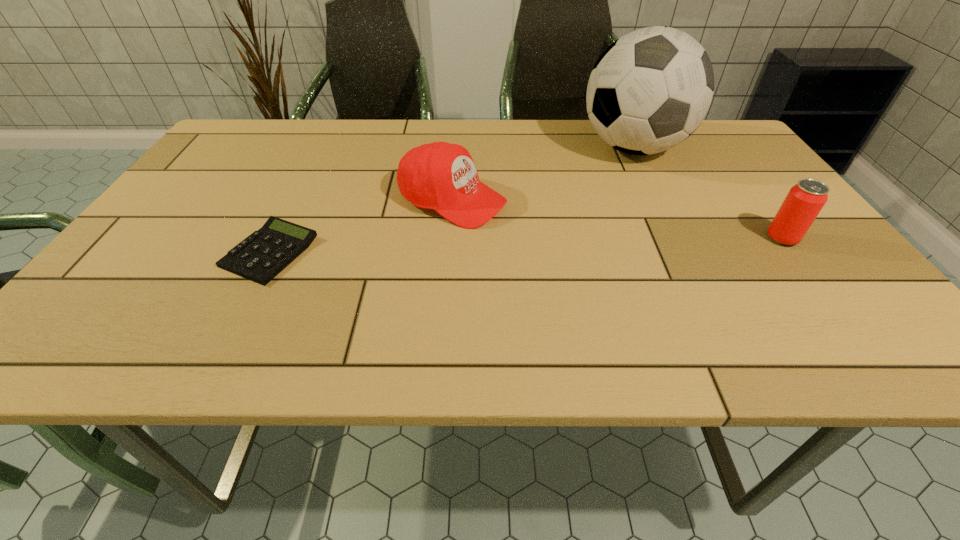
This screenshot has width=960, height=540. What are the coordinates of `the leftmost object` in the screenshot? It's located at (x=260, y=257).

I want to click on calculator, so click(x=260, y=257).

The image size is (960, 540). I want to click on the rightmost object, so click(x=804, y=201).

Locate an element on the screen. The image size is (960, 540). the third object from left to right is located at coordinates (650, 89).

Where is `the tallest object`? The width and height of the screenshot is (960, 540). the tallest object is located at coordinates (650, 89).

Where is `the second object from left to right`? the second object from left to right is located at coordinates (441, 176).

Identify the location of free region located on the back of the calculator. (324, 144).

Where is `free space located on the back of the rightmost object`? The height and width of the screenshot is (540, 960). free space located on the back of the rightmost object is located at coordinates (750, 195).

You are a GUI agent. You are given a task and a screenshot of the screen. Output one action in this format:
    pyautogui.click(x=<x>, y=<y>)
    Task: Click on the vacant space positioned 0.140m on the main logo of the third object from left to right
    
    Given the screenshot: What is the action you would take?
    pyautogui.click(x=606, y=203)

Find the location of a particular element. vacant space located on the main logo of the third object from left to right is located at coordinates (600, 215).